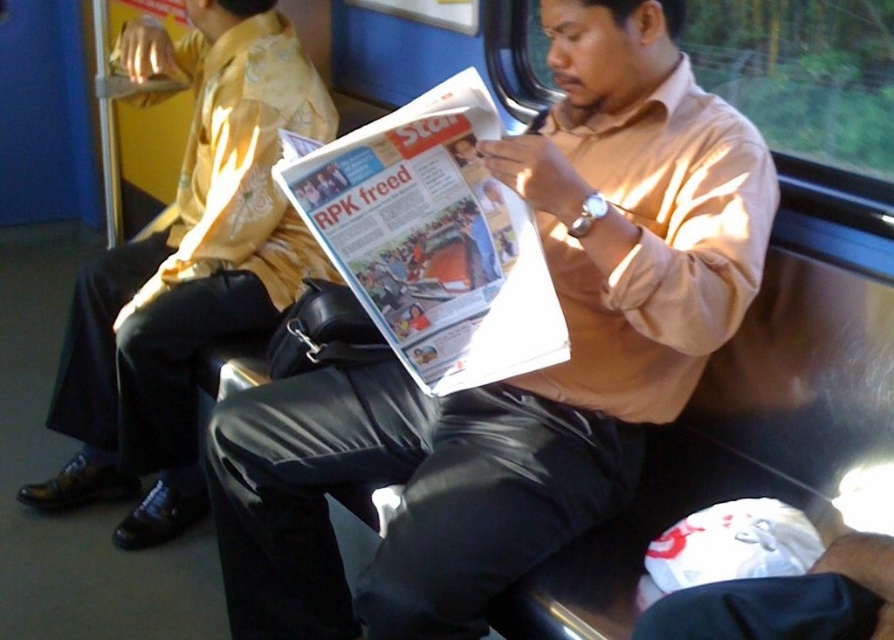
What do you see at coordinates (521, 376) in the screenshot? This screenshot has width=894, height=640. I see `matte brown shirt at center` at bounding box center [521, 376].

Which is above, matte brown shirt at center or white glossy newspaper at center?

white glossy newspaper at center is higher up.

This screenshot has height=640, width=894. Find the location of `matte brown shirt at center`. matte brown shirt at center is located at coordinates [x=521, y=376].

Where is `matte brown shirt at center`? This screenshot has width=894, height=640. matte brown shirt at center is located at coordinates (521, 376).

Is point (207, 248) positioned before point (363, 236)?

No, it is behind (363, 236).

You are a GUI agent. You are given a task and a screenshot of the screen. Output one action in this format:
    pyautogui.click(x=<x>, y=<y>)
    Task: Click on the matte black pants at lower left
    
    Given the screenshot: What is the action you would take?
    (186, 268)

At what (x,y) coordinates should I click in order to perform the action: click on matte black pants at lower left. Please return your answer as a coordinate pair (x, y). Looking at the image, I should click on [x=186, y=268].

You are a GUI agent. You are given a task and a screenshot of the screen. Output one action in this format:
    pyautogui.click(x=<x>, y=<y>)
    Task: Click on the matte black pants at lower left
    The height and width of the screenshot is (640, 894).
    Given the screenshot: What is the action you would take?
    pyautogui.click(x=186, y=268)

Measure the distance between point [755,170] and camera.

1.20 meters

Does matte brown shirt at center have a lesser height compared to matte black pants at lower left?

Correct, matte brown shirt at center is not as tall as matte black pants at lower left.

Which is behind, point (507, 520) or point (238, 328)?

The point (238, 328) is behind.

You are a GUI agent. You are given a task and a screenshot of the screen. Output one action in this format:
    pyautogui.click(x=<x>, y=<y>)
    Task: Click on the matte brown shirt at center
    
    Given the screenshot: What is the action you would take?
    pyautogui.click(x=521, y=376)